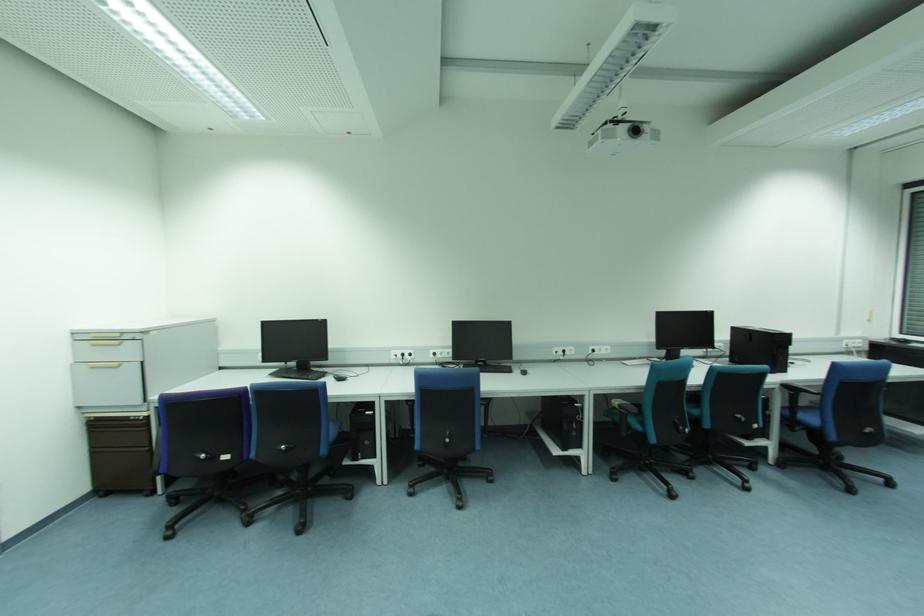
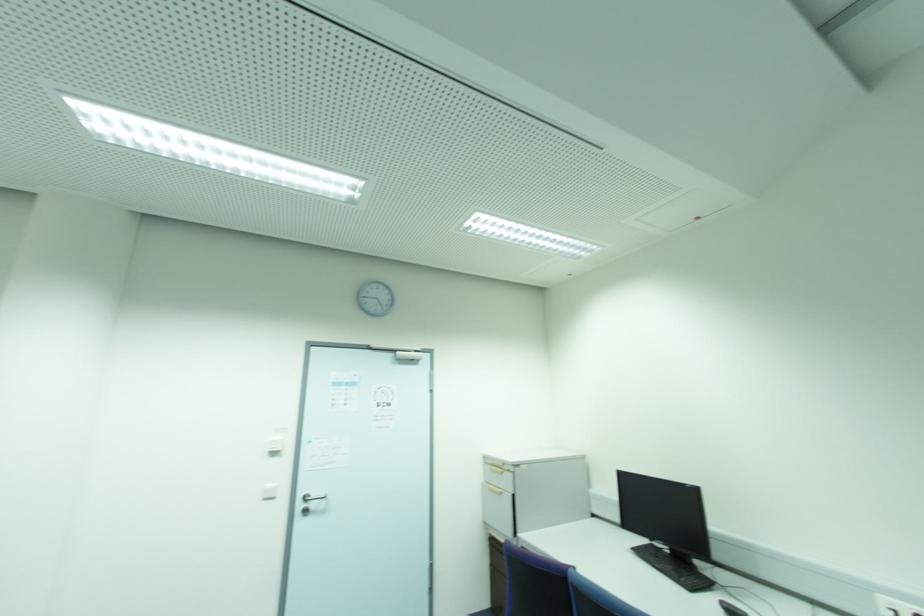
The point at [122,344] is marked in the first image. Where is the corresponding point in the second image?

(503, 472)